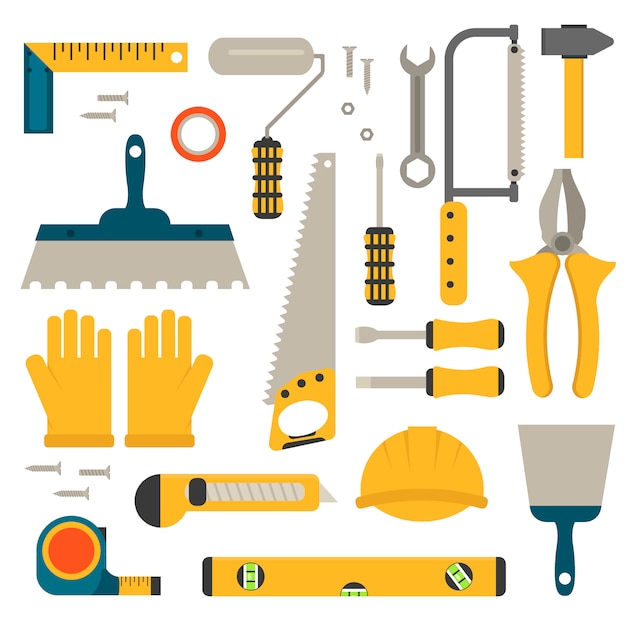
I want to click on black dots on handles, so click(446, 285), click(453, 264), click(451, 250), click(449, 212), click(326, 380), click(305, 387), click(284, 398).